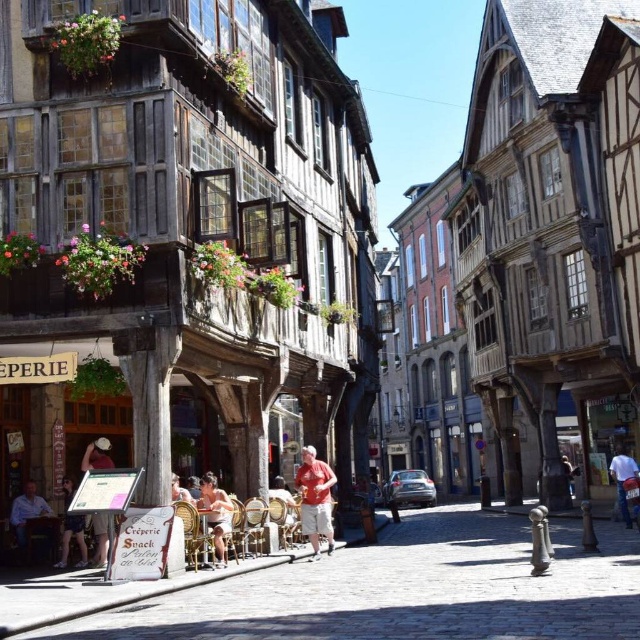
Can you confirm if matte red shirt at center is bigger than light brown wooden chair at lower center?

Yes, matte red shirt at center is bigger than light brown wooden chair at lower center.

Between point (289, 532) and point (186, 492), which one is positioned behind?

Positioned behind is point (289, 532).

At what (x,y) coordinates should I click in order to perform the action: click on matte red shirt at center. Please return your answer as a coordinate pair (x, y). The height and width of the screenshot is (640, 640). Looking at the image, I should click on (282, 508).

Which is more to the left, matte white hat at center or matte red shirt at center?

matte white hat at center is more to the left.

Is point (102, 541) positioned after point (289, 509)?

No, it is in front of (289, 509).

Where is `matte white hat at center`? The width and height of the screenshot is (640, 640). matte white hat at center is located at coordinates (97, 456).

Locate an element on the screen. matte white hat at center is located at coordinates (97, 456).

Who is lower down, red cotton shirt at center or light brown wooden chair at lower left?

red cotton shirt at center

Can you confirm if red cotton shirt at center is positioned to the left of light brown wooden chair at lower left?

In fact, red cotton shirt at center is to the right of light brown wooden chair at lower left.

Between point (305, 452) and point (35, 497), which one is positioned in front?

Positioned in front is point (35, 497).

Locate an element on the screen. red cotton shirt at center is located at coordinates (316, 499).